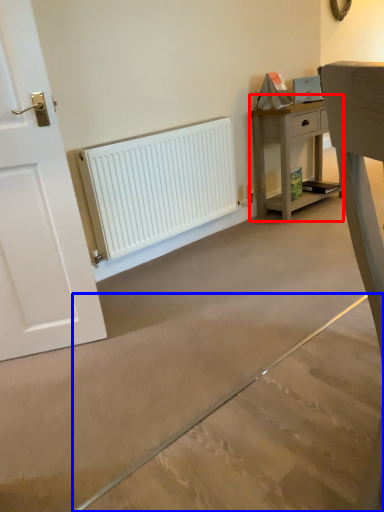
Question: Which of the following is the closest to the observer, nightstand (highlighted by a red box) or concrete (highlighted by a blue box)?

Choices:
 (A) nightstand
 (B) concrete

Answer: (B)